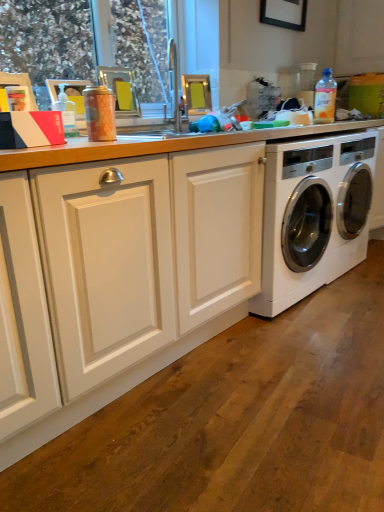
Question: Do you think transparent plastic bottle at upper left, marked as the 2th bottle in a back-to-front arrangement, is within matte silver sink at upper center, or outside of it?

Choices:
 (A) inside
 (B) outside

Answer: (B)

Question: Is transparent plastic bottle at upper left, the first bottle from the left, wider or thinner than matte silver sink at upper center?

Choices:
 (A) thin
 (B) wide

Answer: (A)

Question: Estimate the real-world distances between objects in this image. Which object is closer to the translucent plastic bottle at upper right, which is counted as the 2th bottle, starting from the left?

Choices:
 (A) transparent plastic window screen at upper left
 (B) matte silver sink at upper center
 (C) transparent plastic bottle at upper left, arranged as the first bottle when ordered from the bottom
 (D) white wood countertop at center
 (E) white glossy washing machine at right

Answer: (E)

Question: Which of these objects is positioned closest to the white glossy washing machine at right?

Choices:
 (A) white wood countertop at center
 (B) transparent plastic bottle at upper left, the second bottle from the top
 (C) transparent plastic window screen at upper left
 (D) translucent plastic bottle at upper right, the 1th bottle positioned from the back
 (E) matte silver sink at upper center

Answer: (D)